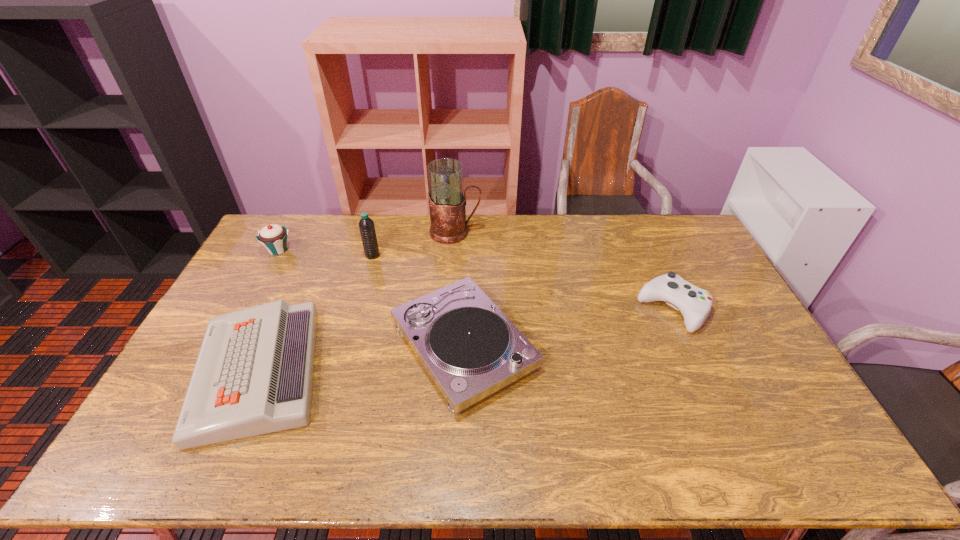
Locate an element on the screen. object positioned at the far left corner is located at coordinates (273, 237).

I want to click on object at the near left corner, so click(x=254, y=373).

This screenshot has height=540, width=960. Find the location of `free spot at the far edge of the desktop`. free spot at the far edge of the desktop is located at coordinates (611, 231).

The height and width of the screenshot is (540, 960). Find the location of `vacant space at the near edge of the desktop`. vacant space at the near edge of the desktop is located at coordinates (262, 458).

Where is `vacant space at the left edge of the desktop`? vacant space at the left edge of the desktop is located at coordinates [273, 260].

The height and width of the screenshot is (540, 960). Find the location of `blank area at the right edge`. blank area at the right edge is located at coordinates (703, 264).

Locate an element on the screen. This screenshot has height=540, width=960. free spot between the third tallest object and the third shortest object is located at coordinates (371, 298).

In order to click on free area in between the cupcake and the control in this screenshot , I will do `click(476, 279)`.

Where is `vacant area that lies between the cupcake and the second tallest object`? vacant area that lies between the cupcake and the second tallest object is located at coordinates (325, 253).

Locate an element on the screen. The image size is (960, 540). free spot between the computer keyboard and the tallest object is located at coordinates (356, 302).